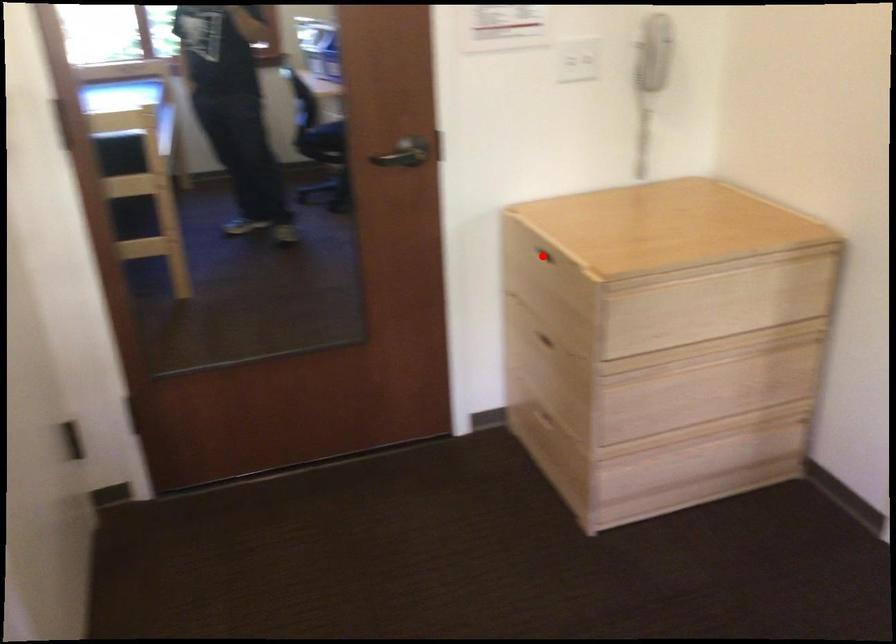
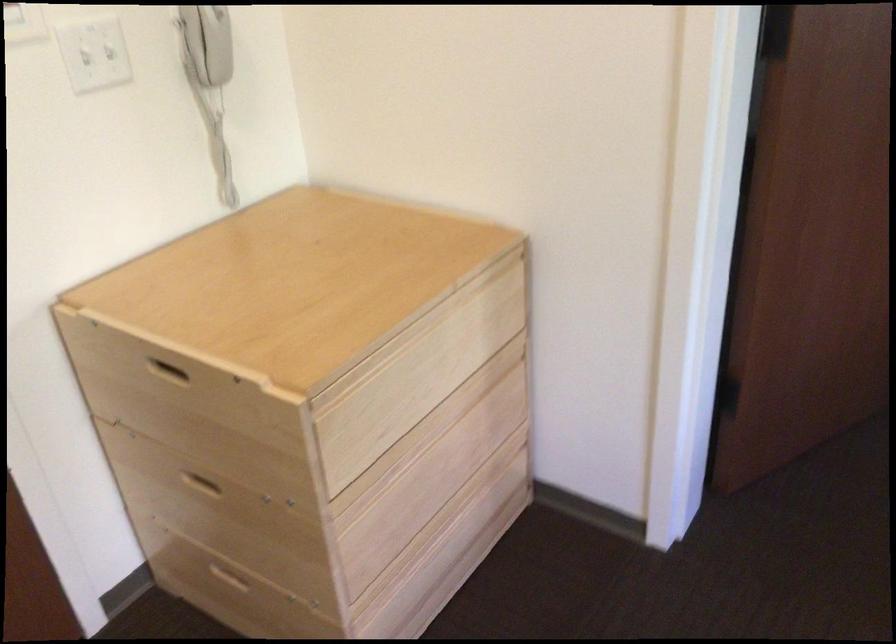
Question: I am providing you with two images of the same scene from different viewpoints. Image1 has a red point marked. In image2, the corresponding 3D location appears at what relative position? Reply with the corresponding letter.

Choices:
 (A) Closer
 (B) Farther

Answer: (A)